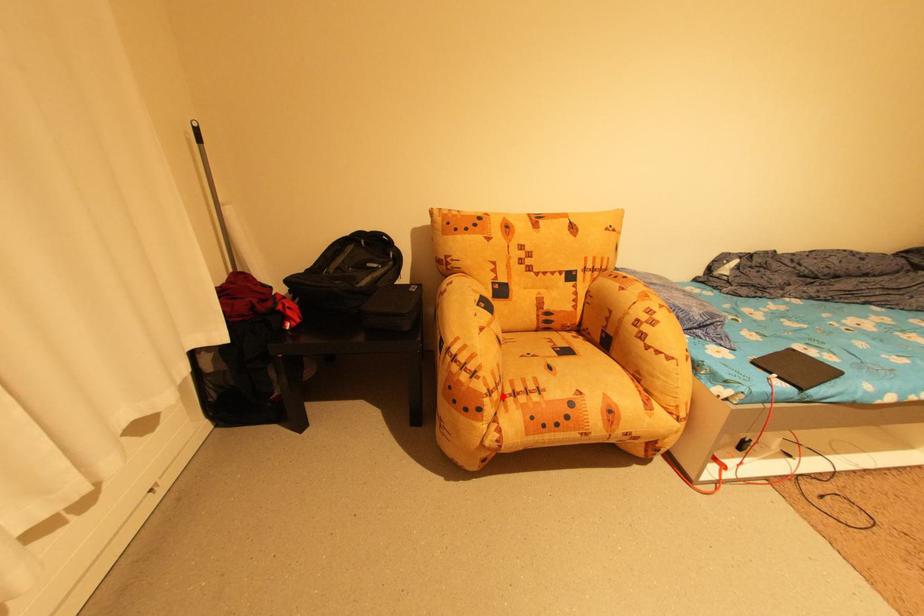
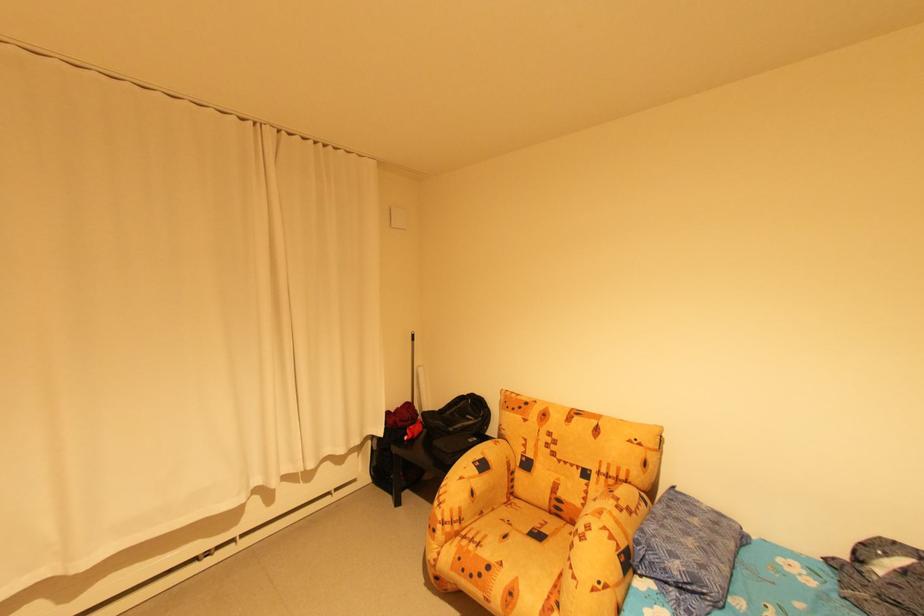
Question: I am providing you with two images of the same scene from different viewpoints. A red point is marked on the first image. Can you still see the location of the red point in image 2?

Choices:
 (A) Yes
 (B) No

Answer: (A)